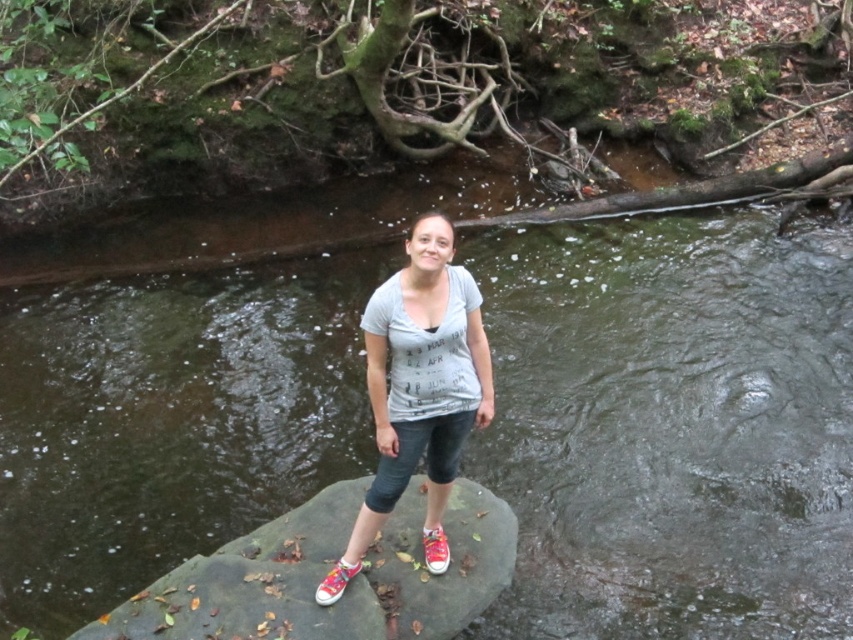
Question: Which of the following is the closest to the observer?

Choices:
 (A) gray stone at center
 (B) shiny red canvas shoe at center
 (C) shiny pink canvas shoe at center

Answer: (A)

Question: Observing the image, what is the correct spatial positioning of gray stone at center in reference to shiny pink canvas shoe at center?

Choices:
 (A) above
 (B) below

Answer: (B)

Question: Can you confirm if shiny pink canvas shoe at center is positioned above shiny red canvas shoe at center?

Choices:
 (A) yes
 (B) no

Answer: (B)

Question: Which point appears farthest from the camera in this image?

Choices:
 (A) (428, 566)
 (B) (445, 614)

Answer: (A)

Question: Can you confirm if matte gray t-shirt at center is positioned to the left of shiny pink canvas shoe at center?

Choices:
 (A) yes
 (B) no

Answer: (B)

Question: Among these objects, which one is nearest to the camera?

Choices:
 (A) shiny pink canvas shoe at center
 (B) gray stone at center

Answer: (B)